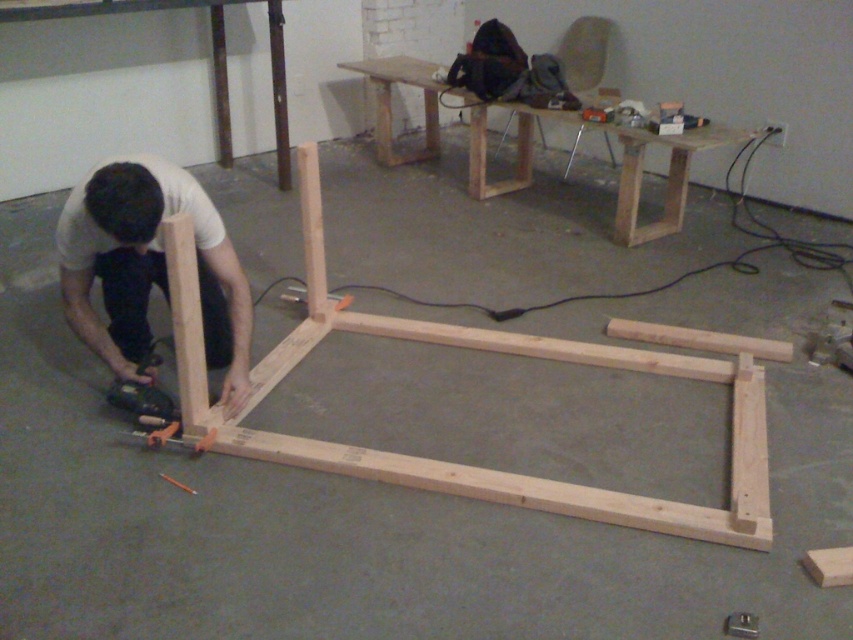
Between matte wood man at lower left and metallic gray drill at lower left, which one is positioned higher?

matte wood man at lower left

Which is more to the right, matte wood man at lower left or metallic gray drill at lower left?

matte wood man at lower left is more to the right.

The width and height of the screenshot is (853, 640). Find the location of `matte wood man at lower left`. matte wood man at lower left is located at coordinates (149, 269).

Does matte wood man at lower left appear over light brown wood plank at lower right?

Yes.

Who is more forward, (178,202) or (817,572)?

Point (817,572) is in front.

Does point (144, 340) lie in front of point (802, 560)?

No, (144, 340) is behind (802, 560).

The height and width of the screenshot is (640, 853). Find the location of `matte wood man at lower left`. matte wood man at lower left is located at coordinates (149, 269).

Does point (849, 582) come in front of point (201, 445)?

Yes.

Between light brown wood plank at lower right and metallic gray drill at lower left, which one has less height?

light brown wood plank at lower right

Which is behind, point (821, 563) or point (146, 424)?

The point (146, 424) is more distant.

Where is `light brown wood plank at lower right`? This screenshot has width=853, height=640. light brown wood plank at lower right is located at coordinates (828, 564).